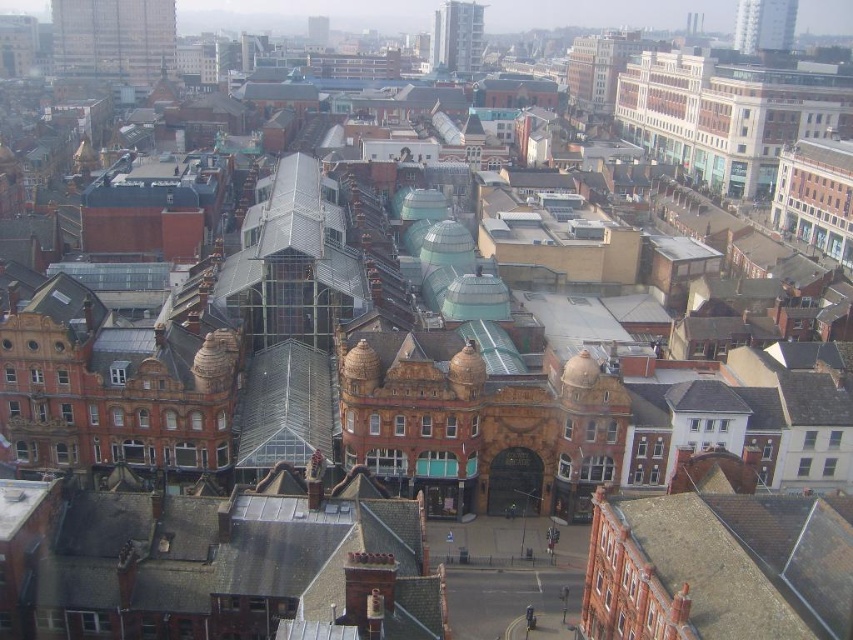
Does white glass building at upper center have a smaller size compared to smooth glass tower at upper center?

Actually, white glass building at upper center might be larger than smooth glass tower at upper center.

Is white glass building at upper center bigger than smooth glass tower at upper center?

Yes, white glass building at upper center is bigger than smooth glass tower at upper center.

Between point (469, 10) and point (316, 26), which one is positioned in front?

Positioned in front is point (469, 10).

Identify the location of white glass building at upper center. (457, 36).

Can you confirm if metallic glass tower at upper left is positioned below smooth glass tower at upper center?

Yes, metallic glass tower at upper left is below smooth glass tower at upper center.

Who is positioned more to the left, metallic glass tower at upper left or smooth glass tower at upper center?

metallic glass tower at upper left is more to the left.

Between point (120, 38) and point (325, 44), which one is positioned in front?

Positioned in front is point (120, 38).

Identify the location of metallic glass tower at upper left. The width and height of the screenshot is (853, 640). (114, 38).

Which is behind, point (84, 32) or point (767, 28)?

Positioned behind is point (84, 32).

What do you see at coordinates (114, 38) in the screenshot? The image size is (853, 640). I see `metallic glass tower at upper left` at bounding box center [114, 38].

Locate an element on the screen. Image resolution: width=853 pixels, height=640 pixels. metallic glass tower at upper left is located at coordinates (114, 38).